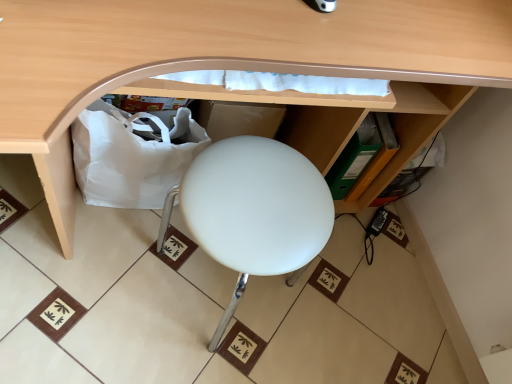
Question: Is matte wood desk at center smaller than white fabric bag at lower left?

Choices:
 (A) no
 (B) yes

Answer: (A)

Question: Does matte wood desk at center have a lesser height compared to white fabric bag at lower left?

Choices:
 (A) yes
 (B) no

Answer: (B)

Question: Considering the relative sizes of matte wood desk at center and white fabric bag at lower left in the image provided, is matte wood desk at center wider than white fabric bag at lower left?

Choices:
 (A) no
 (B) yes

Answer: (B)

Question: Can you confirm if matte wood desk at center is bigger than white fabric bag at lower left?

Choices:
 (A) no
 (B) yes

Answer: (B)

Question: From the image's perspective, is matte wood desk at center beneath white fabric bag at lower left?

Choices:
 (A) no
 (B) yes

Answer: (A)

Question: Considering the positions of point (233, 160) and point (112, 168), is point (233, 160) closer or farther from the camera than point (112, 168)?

Choices:
 (A) farther
 (B) closer

Answer: (B)

Question: From the image's perspective, is white matte stool at center positioned above or below white fabric bag at lower left?

Choices:
 (A) above
 (B) below

Answer: (B)

Question: Is white matte stool at center wider or thinner than white fabric bag at lower left?

Choices:
 (A) thin
 (B) wide

Answer: (B)

Question: Considering the relative positions of white matte stool at center and white fabric bag at lower left in the image provided, is white matte stool at center to the left or to the right of white fabric bag at lower left?

Choices:
 (A) left
 (B) right

Answer: (B)

Question: Is white matte stool at center wider or thinner than matte wood desk at center?

Choices:
 (A) thin
 (B) wide

Answer: (A)

Question: Based on their sizes in the image, would you say white matte stool at center is bigger or smaller than matte wood desk at center?

Choices:
 (A) big
 (B) small

Answer: (B)

Question: Considering the positions of white matte stool at center and matte wood desk at center in the image, is white matte stool at center taller or shorter than matte wood desk at center?

Choices:
 (A) short
 (B) tall

Answer: (A)

Question: Does point (293, 266) appear closer or farther from the camera than point (56, 218)?

Choices:
 (A) farther
 (B) closer

Answer: (B)

Question: Based on their sizes in the image, would you say white fabric bag at lower left is bigger or smaller than matte wood desk at center?

Choices:
 (A) small
 (B) big

Answer: (A)

Question: Does point (121, 182) appear closer or farther from the camera than point (4, 102)?

Choices:
 (A) closer
 (B) farther

Answer: (B)